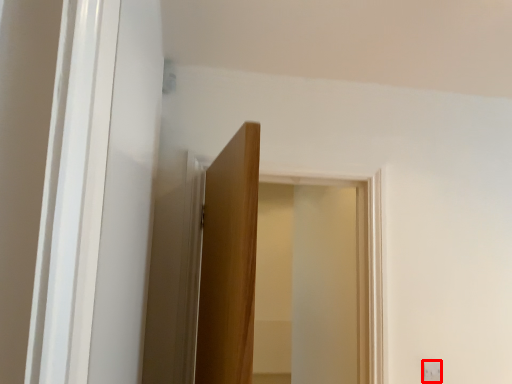
Question: Observing the image, what is the correct spatial positioning of light switch (annotated by the red box) in reference to window?

Choices:
 (A) right
 (B) left

Answer: (A)